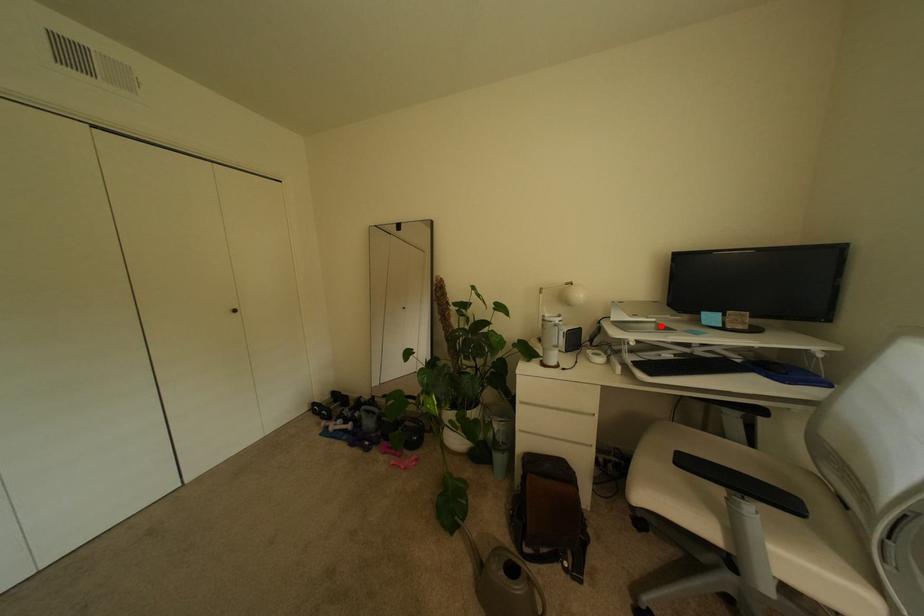
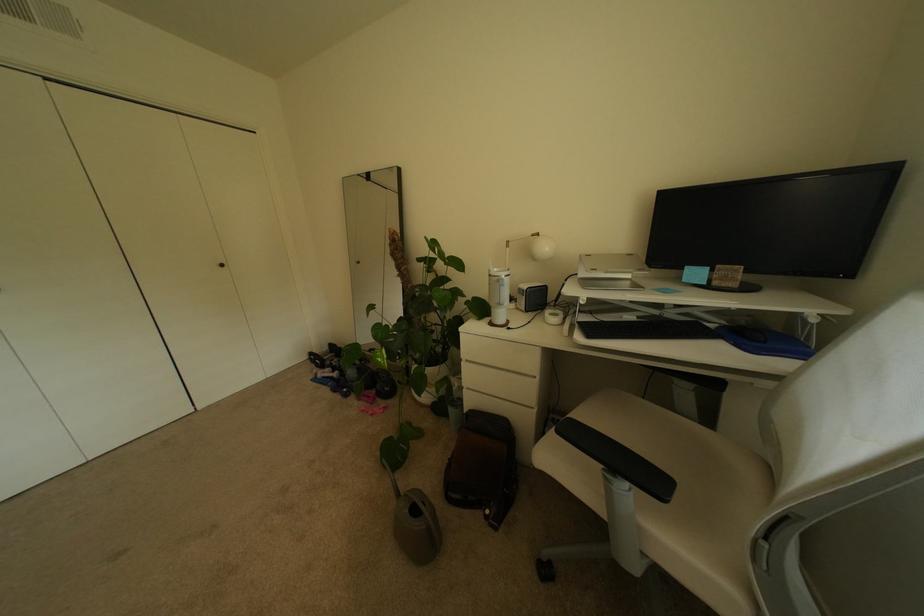
Locate, in the second image, the point that corresponds to the highlighted location in the first image.

(637, 284)